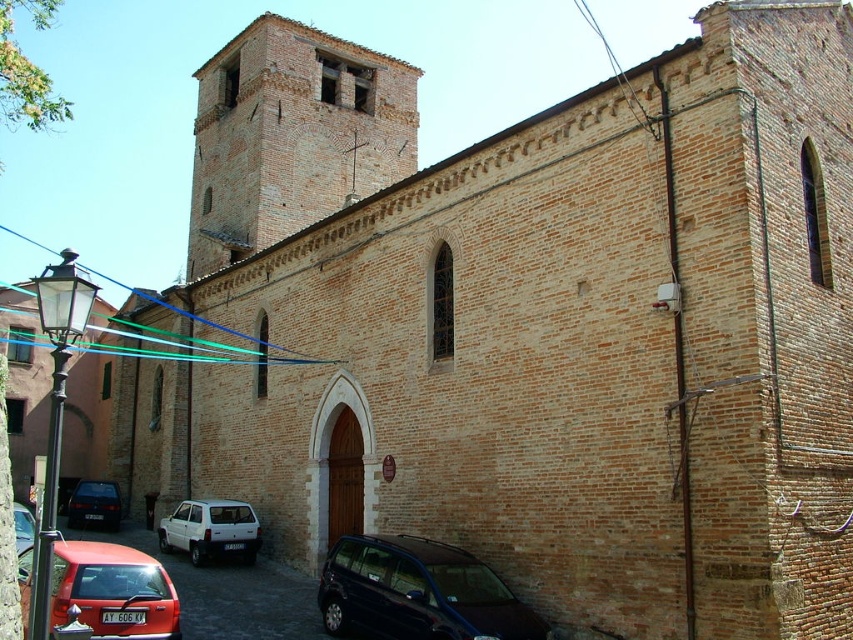
Question: Does matte red hatchback at lower left have a greater width compared to matte black car at lower left?

Choices:
 (A) yes
 (B) no

Answer: (A)

Question: Is matte red hatchback at lower left wider than white matte hatchback at lower left?

Choices:
 (A) no
 (B) yes

Answer: (B)

Question: Does dark blue metallic van at lower center lie in front of matte black car at lower left?

Choices:
 (A) yes
 (B) no

Answer: (A)

Question: Based on their relative distances, which object is nearer to the matte black car at lower left?

Choices:
 (A) white matte hatchback at lower left
 (B) matte red hatchback at lower left

Answer: (A)

Question: Which of the following is the closest to the observer?

Choices:
 (A) matte red hatchback at lower left
 (B) dark blue metallic van at lower center
 (C) matte red car at lower left
 (D) brown brick tower at upper center

Answer: (A)

Question: Which object is positioned farthest from the matte red car at lower left?

Choices:
 (A) dark blue metallic van at lower center
 (B) matte red hatchback at lower left

Answer: (A)